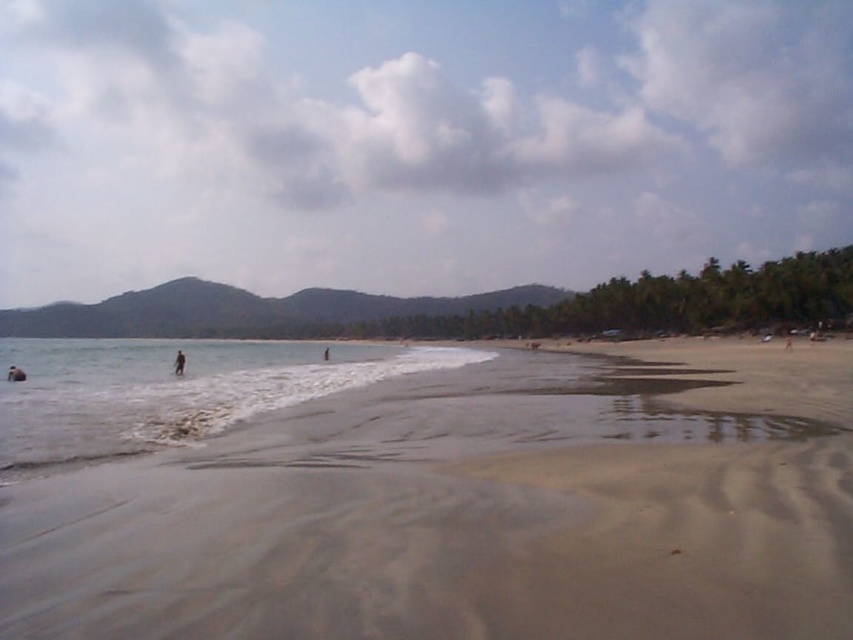
You are standing on the beach and want to walk towards the clear water at lower left without getting your feet wet. The dark brown skin at lower left is a person. Which direction should you move to avoid the water?

Since the clear water at lower left is wider than the dark brown skin at lower left, you should move towards the right side of the dark brown skin at lower left to avoid the water.

You are standing at the center of the beach scene. Which direction should you walk to reach the dark brown skin at lower left?

The dark brown skin at lower left is located at point (178, 362), which is to the left and lower part of the image. Since you are at the center, you should walk towards the lower left direction to reach it.